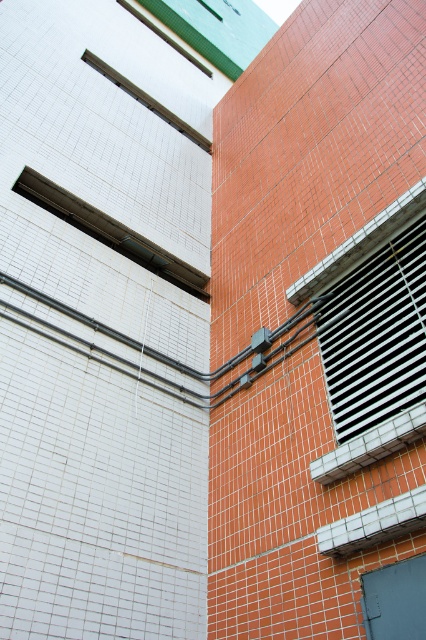
Question: Estimate the real-world distances between objects in this image. Which object is closer to the matte glass window at upper left?

Choices:
 (A) black metal window at right
 (B) matte glass window at upper center

Answer: (A)

Question: Is the position of black metal window at right more distant than that of matte glass window at upper center?

Choices:
 (A) no
 (B) yes

Answer: (A)

Question: Is black metal window at right thinner than matte glass window at upper center?

Choices:
 (A) yes
 (B) no

Answer: (A)

Question: Which point appears closest to the camera in this image?

Choices:
 (A) (391, 333)
 (B) (149, 106)
 (C) (169, 275)

Answer: (A)

Question: Which point is farther from the camera taking this photo?

Choices:
 (A) (155, 246)
 (B) (362, 336)

Answer: (A)

Question: Does matte glass window at upper left appear under matte glass window at upper center?

Choices:
 (A) no
 (B) yes

Answer: (B)